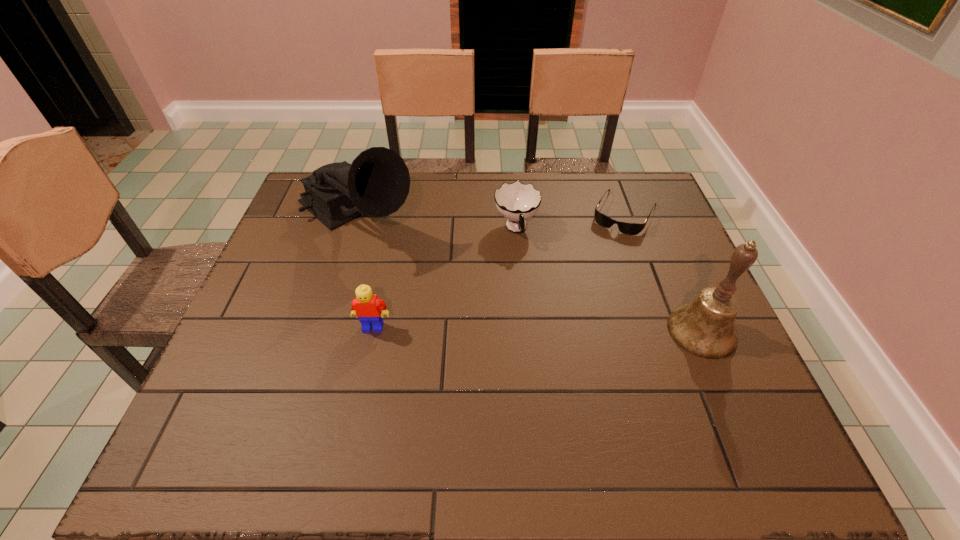
Identify the location of vacant area situated on the side of the third object from right to left with the handle. (531, 291).

Find the location of `free spot located from the horn of the phonograph_record`. free spot located from the horn of the phonograph_record is located at coordinates (494, 336).

Locate an element on the screen. free space located from the horn of the phonograph_record is located at coordinates (405, 261).

In order to click on vacant region located from the horn of the phonograph_record in this screenshot , I will do `click(423, 276)`.

The width and height of the screenshot is (960, 540). Find the location of `free space located on the front-facing side of the shortest object`. free space located on the front-facing side of the shortest object is located at coordinates (574, 308).

At what (x,y) coordinates should I click in order to perform the action: click on free space located 0.120m on the front-facing side of the shortest object. Please return your answer as a coordinate pair (x, y). This screenshot has width=960, height=540. Looking at the image, I should click on (601, 259).

Identify the location of free location located 0.290m on the front-facing side of the shortest object. (579, 300).

You are a GUI agent. You are given a task and a screenshot of the screen. Output one action in this format:
    pyautogui.click(x=<x>, y=<y>)
    Task: Click on the cup present at the far edge
    
    Given the screenshot: What is the action you would take?
    pyautogui.click(x=517, y=202)

At what (x,y) coordinates should I click in order to perform the action: click on phonograph_record at the far edge. Please return your answer as a coordinate pair (x, y). This screenshot has width=960, height=540. Looking at the image, I should click on (377, 183).

Identify the location of sunglasses at the far edge. (627, 228).